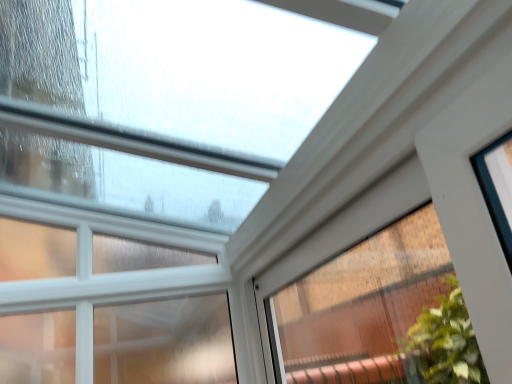
Question: Is clear glass window at upper center, the 2th window from the left, closer to the viewer compared to clear glass window at upper center, acting as the second window starting from the right?

Choices:
 (A) yes
 (B) no

Answer: (A)

Question: Would you consider clear glass window at upper center, which is counted as the 1th window, starting from the right, to be distant from clear glass window at upper center, acting as the second window starting from the right?

Choices:
 (A) no
 (B) yes

Answer: (A)

Question: From the image's perspective, is clear glass window at upper center, the 2th window from the left, over clear glass window at upper center, which is counted as the first window, starting from the left?

Choices:
 (A) yes
 (B) no

Answer: (A)

Question: Is clear glass window at upper center, which is counted as the 1th window, starting from the right, located outside clear glass window at upper center, which is counted as the first window, starting from the left?

Choices:
 (A) yes
 (B) no

Answer: (A)

Question: Does clear glass window at upper center, the 2th window from the left, have a lesser width compared to clear glass window at upper center, acting as the second window starting from the right?

Choices:
 (A) no
 (B) yes

Answer: (B)

Question: Is clear glass window at upper center, which is counted as the 1th window, starting from the right, looking in the opposite direction of clear glass window at upper center, which is counted as the first window, starting from the left?

Choices:
 (A) yes
 (B) no

Answer: (B)

Question: Is clear glass window at upper center, which is counted as the first window, starting from the left, smaller than clear glass window at upper center, which is counted as the 1th window, starting from the right?

Choices:
 (A) yes
 (B) no

Answer: (B)

Question: Considering the relative sizes of clear glass window at upper center, which is counted as the first window, starting from the left, and clear glass window at upper center, the 2th window from the left, in the image provided, is clear glass window at upper center, which is counted as the first window, starting from the left, wider than clear glass window at upper center, the 2th window from the left,?

Choices:
 (A) yes
 (B) no

Answer: (A)

Question: Is clear glass window at upper center, acting as the second window starting from the right, oriented towards clear glass window at upper center, which is counted as the 1th window, starting from the right?

Choices:
 (A) no
 (B) yes

Answer: (B)

Question: Is clear glass window at upper center, which is counted as the first window, starting from the left, next to clear glass window at upper center, the 2th window from the left, and touching it?

Choices:
 (A) yes
 (B) no

Answer: (B)

Question: Does clear glass window at upper center, which is counted as the first window, starting from the left, contain clear glass window at upper center, the 2th window from the left?

Choices:
 (A) no
 (B) yes

Answer: (A)

Question: Is clear glass window at upper center, which is counted as the first window, starting from the left, at the right side of clear glass window at upper center, which is counted as the 1th window, starting from the right?

Choices:
 (A) yes
 (B) no

Answer: (B)

Question: Is clear glass window at upper center, which is counted as the first window, starting from the left, to the left or to the right of clear glass window at upper center, which is counted as the 1th window, starting from the right, in the image?

Choices:
 (A) right
 (B) left

Answer: (B)